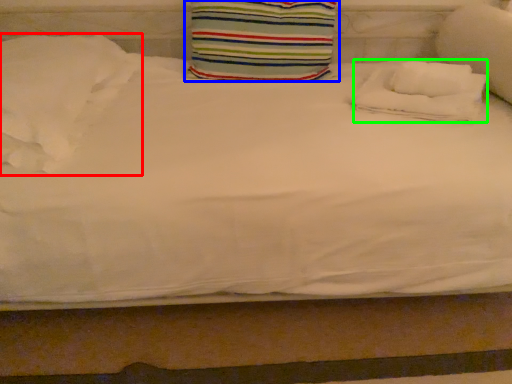
Question: Which object is the closest to the pillow (highlighted by a red box)? Choose among these: pillow (highlighted by a blue box) or pillow (highlighted by a green box).

Choices:
 (A) pillow
 (B) pillow

Answer: (A)